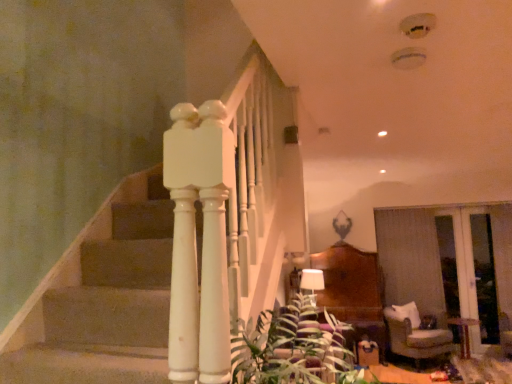
Question: In the image, is beige fabric armchair at lower right on the left side or the right side of wooden glossy table at lower right?

Choices:
 (A) left
 (B) right

Answer: (A)

Question: Is beige fabric armchair at lower right taller or shorter than wooden glossy table at lower right?

Choices:
 (A) tall
 (B) short

Answer: (A)

Question: Which object is positioned farthest from the transparent glass door at right?

Choices:
 (A) beige fabric armchair at lower right
 (B) white fabric lampshade at center
 (C) green leafy plant at lower center
 (D) wooden glossy table at lower right

Answer: (C)

Question: Which object is the closest to the wooden glossy table at lower right?

Choices:
 (A) beige fabric armchair at lower right
 (B) white fabric lampshade at center
 (C) green leafy plant at lower center
 (D) transparent glass door at right

Answer: (D)